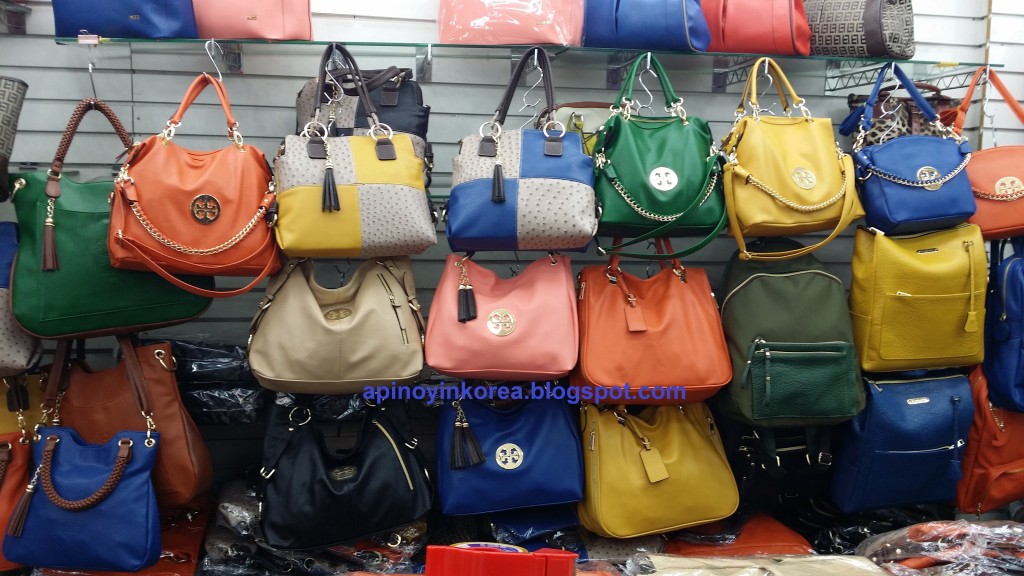
What are the coordinates of `wall of purses` in the screenshot? It's located at (543, 334).